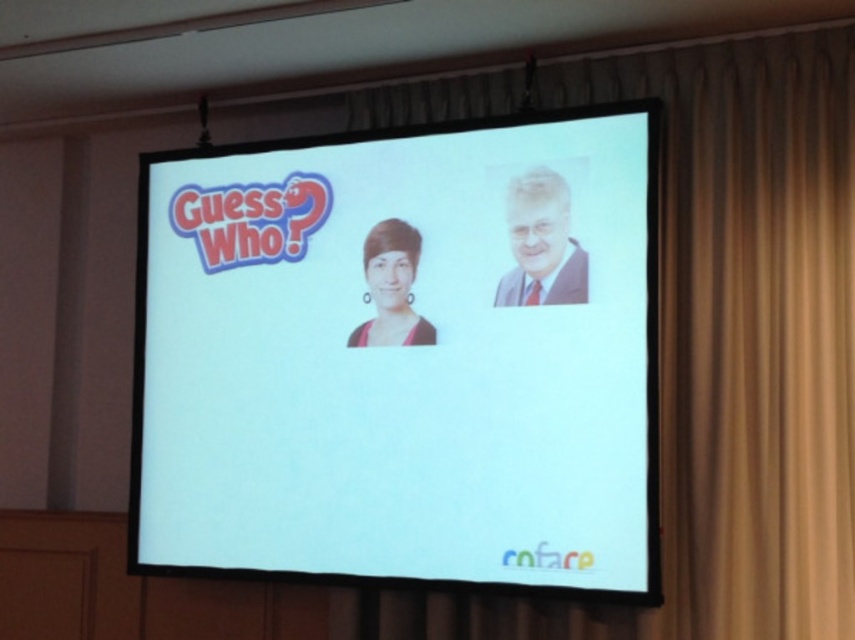
Does white glossy screen at center have a greater width compared to matte gray suit at upper right?

Correct, the width of white glossy screen at center exceeds that of matte gray suit at upper right.

Does point (556, 538) lie behind point (545, 216)?

No, it is in front of (545, 216).

The image size is (855, 640). In order to click on white glossy screen at center in this screenshot , I will do `click(404, 355)`.

Does beige fabric curtain at upper center have a greater height compared to matte gray suit at upper right?

Correct, beige fabric curtain at upper center is much taller as matte gray suit at upper right.

Is beige fabric curtain at upper center below matte gray suit at upper right?

Yes.

Is point (799, 264) positioned after point (525, 216)?

No.

I want to click on beige fabric curtain at upper center, so click(729, 349).

Who is higher up, white glossy screen at center or beige fabric curtain at upper center?

beige fabric curtain at upper center is higher up.

Does point (426, 564) come in front of point (702, 387)?

No.

Find the location of `white glossy screen at center`. white glossy screen at center is located at coordinates (404, 355).